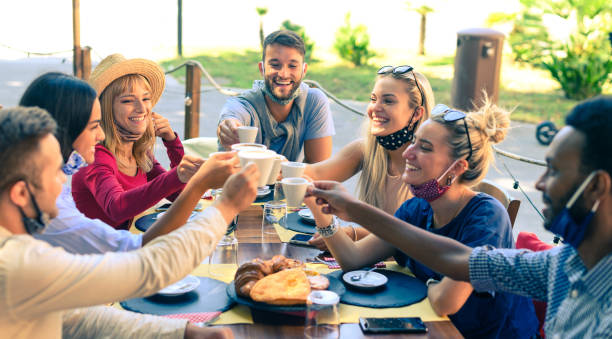
Where is `dishes`? dishes is located at coordinates (308, 216), (259, 193), (183, 285), (360, 284).